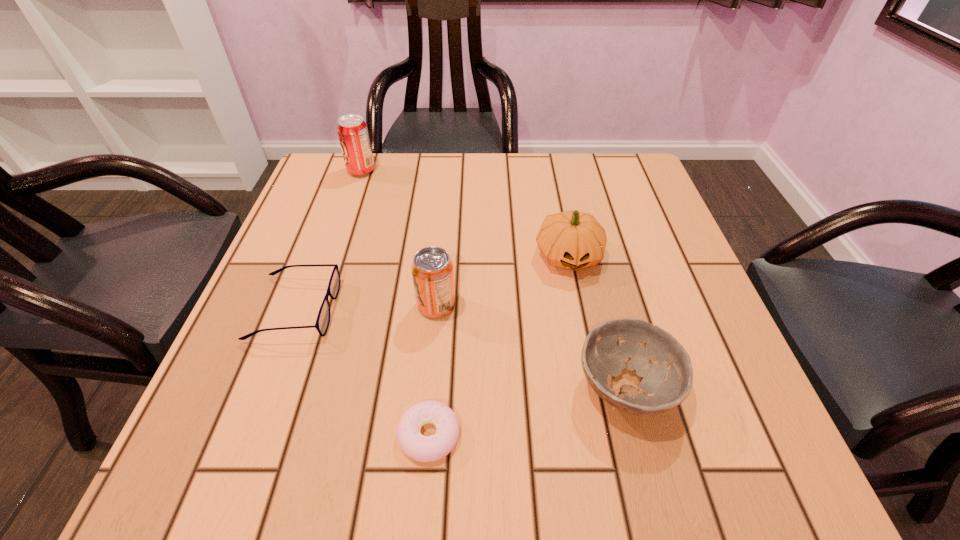
The image size is (960, 540). I want to click on object at the near right corner, so click(x=667, y=383).

This screenshot has width=960, height=540. Find the location of `vacant space at the far edge of the desktop`. vacant space at the far edge of the desktop is located at coordinates (457, 171).

Where is `vacant space at the near edge of the desktop`? vacant space at the near edge of the desktop is located at coordinates click(495, 471).

Where is `vacant space at the left edge of the desktop`? vacant space at the left edge of the desktop is located at coordinates (298, 421).

In the image, there is a desktop. Where is `blank space at the far left corner`? The image size is (960, 540). blank space at the far left corner is located at coordinates (345, 180).

In the image, there is a desktop. Identify the location of vacant space at the near left corner. (240, 431).

Find the location of `free space at the far right corner`. free space at the far right corner is located at coordinates (587, 173).

Find the location of a particular element. The width and height of the screenshot is (960, 540). free spot between the spectacles and the farthest object is located at coordinates (328, 240).

Image resolution: width=960 pixels, height=540 pixels. Identify the location of vacant space in between the spectacles and the farther soda can. coord(328,240).

At what (x,y) coordinates should I click in order to perform the action: click on empty space that is in between the shortest object and the gourd. Please return your answer as a coordinate pair (x, y). The image size is (960, 540). Looking at the image, I should click on (499, 345).